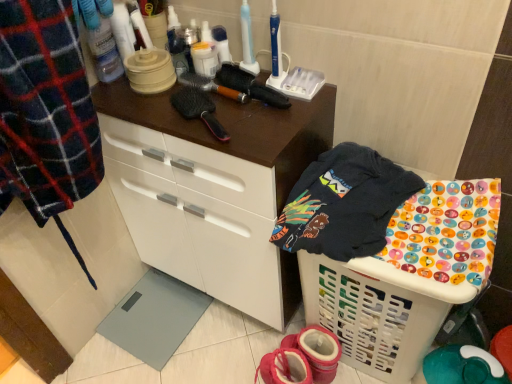
Question: Considering the relative positions of black synthetic hairbrush at upper center and pink fabric booties at lower center in the image provided, is black synthetic hairbrush at upper center behind pink fabric booties at lower center?

Choices:
 (A) no
 (B) yes

Answer: (A)

Question: Can you confirm if black synthetic hairbrush at upper center is taller than pink fabric booties at lower center?

Choices:
 (A) no
 (B) yes

Answer: (A)

Question: Does black synthetic hairbrush at upper center turn towards pink fabric booties at lower center?

Choices:
 (A) yes
 (B) no

Answer: (B)

Question: Considering the relative sizes of black synthetic hairbrush at upper center and pink fabric booties at lower center in the image provided, is black synthetic hairbrush at upper center bigger than pink fabric booties at lower center?

Choices:
 (A) yes
 (B) no

Answer: (B)

Question: Is black synthetic hairbrush at upper center positioned in front of pink fabric booties at lower center?

Choices:
 (A) no
 (B) yes

Answer: (B)

Question: From the image's perspective, is pink fabric booties at lower center above or below white plastic laundry basket at lower right?

Choices:
 (A) above
 (B) below

Answer: (B)

Question: In terms of height, does pink fabric booties at lower center look taller or shorter compared to white plastic laundry basket at lower right?

Choices:
 (A) short
 (B) tall

Answer: (A)

Question: In terms of size, does pink fabric booties at lower center appear bigger or smaller than white plastic laundry basket at lower right?

Choices:
 (A) big
 (B) small

Answer: (B)

Question: From a real-world perspective, is pink fabric booties at lower center physically located above or below white plastic laundry basket at lower right?

Choices:
 (A) below
 (B) above

Answer: (A)

Question: Considering the relative positions of matte white cabinet at center and black synthetic hairbrush at upper center in the image provided, is matte white cabinet at center to the left or to the right of black synthetic hairbrush at upper center?

Choices:
 (A) right
 (B) left

Answer: (A)

Question: In terms of size, does matte white cabinet at center appear bigger or smaller than black synthetic hairbrush at upper center?

Choices:
 (A) big
 (B) small

Answer: (A)

Question: Considering their positions, is matte white cabinet at center located in front of or behind black synthetic hairbrush at upper center?

Choices:
 (A) behind
 (B) front

Answer: (B)

Question: From a real-world perspective, is matte white cabinet at center above or below black synthetic hairbrush at upper center?

Choices:
 (A) above
 (B) below

Answer: (B)

Question: From a real-world perspective, is pink fabric booties at lower center positioned above or below black synthetic hairbrush at upper center?

Choices:
 (A) above
 (B) below

Answer: (B)

Question: In terms of height, does pink fabric booties at lower center look taller or shorter compared to black synthetic hairbrush at upper center?

Choices:
 (A) tall
 (B) short

Answer: (A)